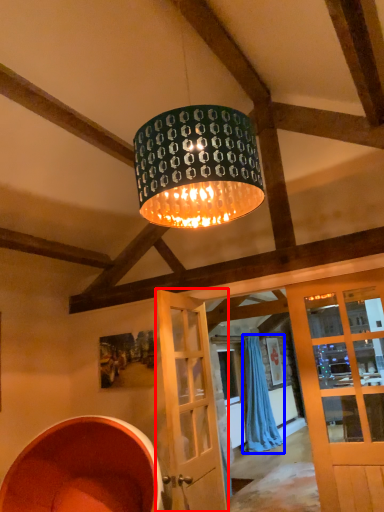
Question: Among these objects, which one is farthest to the camera, door (highlighted by a red box) or curtain (highlighted by a blue box)?

Choices:
 (A) door
 (B) curtain

Answer: (B)